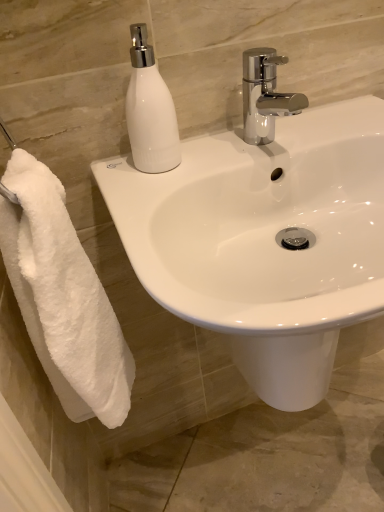
Where is `vacant space that's between white glossy soap dispenser at upper left and chrome metallic faucet at upper center`? vacant space that's between white glossy soap dispenser at upper left and chrome metallic faucet at upper center is located at coordinates (213, 156).